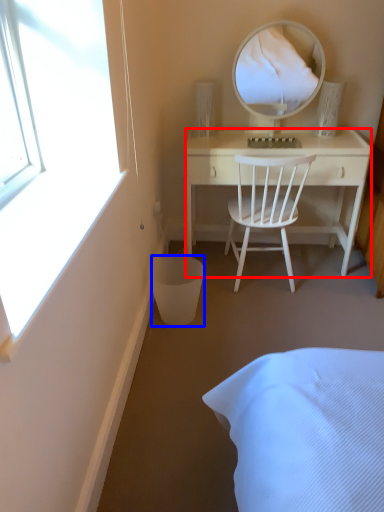
Question: Which point is closer to the camera, desk (highlighted by a red box) or trash bin/can (highlighted by a blue box)?

Choices:
 (A) desk
 (B) trash bin/can

Answer: (B)